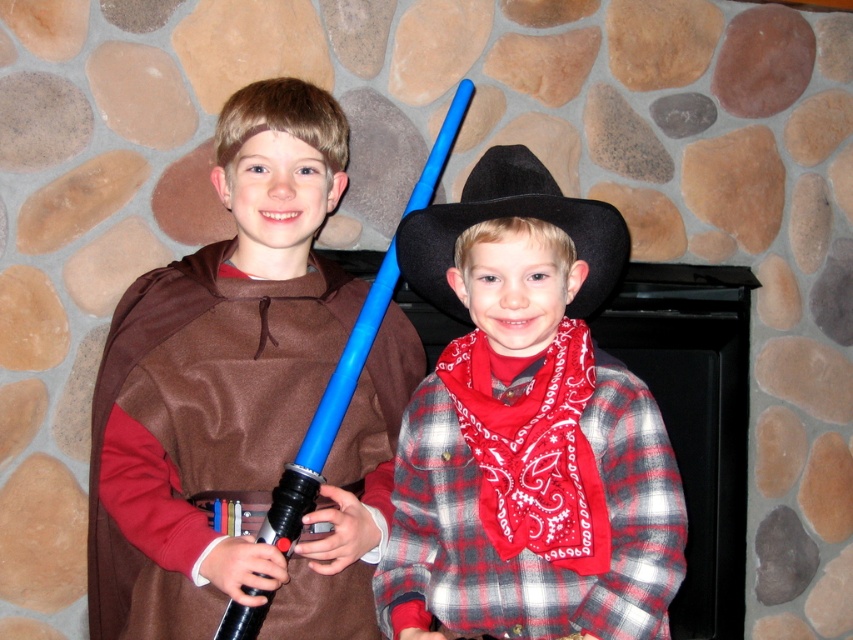
Question: Is matte brown cape at left thinner than red bandana at center?

Choices:
 (A) yes
 (B) no

Answer: (B)

Question: Which point is farther to the camera?

Choices:
 (A) matte brown cape at left
 (B) black felt cowboy hat at center
 (C) red bandana at center
 (D) plaid flannel shirt at center

Answer: (A)

Question: Which object is closer to the camera taking this photo?

Choices:
 (A) red bandana at center
 (B) plaid flannel shirt at center
 (C) matte brown cape at left

Answer: (B)

Question: Which point is closer to the camera?

Choices:
 (A) plaid flannel shirt at center
 (B) red bandana at center
 (C) matte brown cape at left

Answer: (A)

Question: Is matte brown cape at left closer to the viewer compared to plaid flannel shirt at center?

Choices:
 (A) no
 (B) yes

Answer: (A)

Question: Is red bandana at center to the right of black felt cowboy hat at center from the viewer's perspective?

Choices:
 (A) yes
 (B) no

Answer: (A)